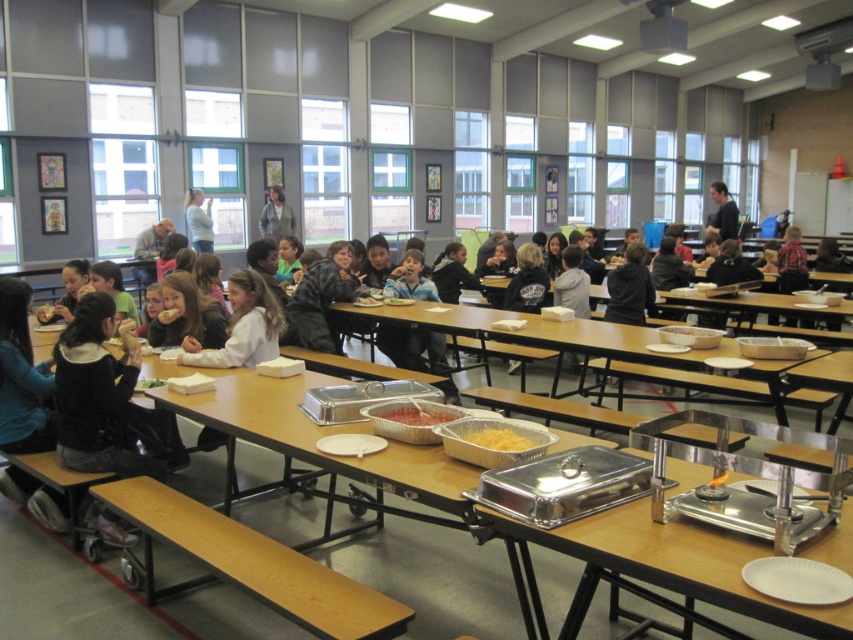
You are a student in the cafeteria and want to take the light blue denim jacket at upper center and the black matte jacket at upper right from the table. Which jacket is covering the other one?

The light blue denim jacket at upper center is positioned over the black matte jacket at upper right, so the light blue denim jacket is covering the black matte jacket.